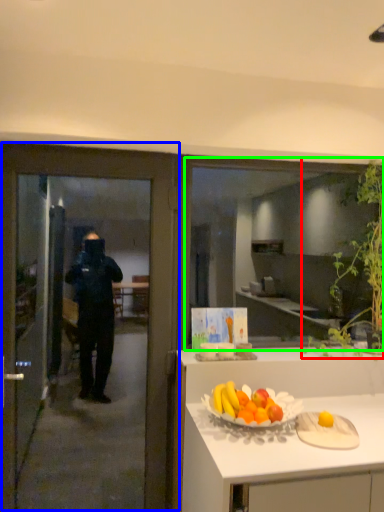
Question: Considering the real-world distances, which object is closest to plant (highlighted by a red box)? door (highlighted by a blue box) or window (highlighted by a green box).

Choices:
 (A) door
 (B) window

Answer: (A)